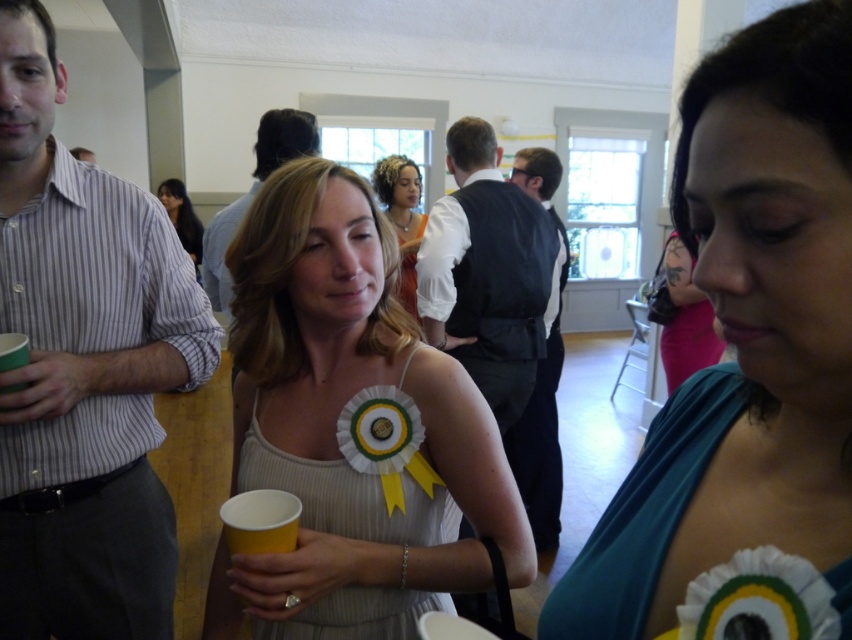
Question: Can you confirm if teal satin ribbon at center is thinner than white fabric dress at center?

Choices:
 (A) no
 (B) yes

Answer: (B)

Question: From the image, what is the correct spatial relationship of white fabric dress at center in relation to dark blue vest at center?

Choices:
 (A) left
 (B) right

Answer: (A)

Question: Is dark blue vest at center to the right of matte white shirt at center from the viewer's perspective?

Choices:
 (A) yes
 (B) no

Answer: (A)

Question: Which point is closer to the camera taking this photo?

Choices:
 (A) (504, 227)
 (B) (674, 387)

Answer: (A)

Question: Based on their relative distances, which object is farther from the black satin vest at center?

Choices:
 (A) striped cotton shirt at left
 (B) teal satin ribbon at center

Answer: (B)

Question: Which point appears farthest from the camera in this image?

Choices:
 (A) (327, 595)
 (B) (441, 216)

Answer: (B)